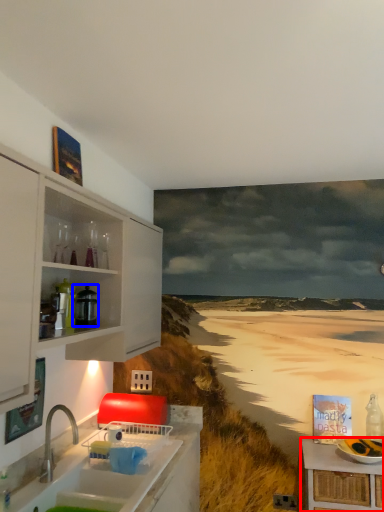
Question: Which object appears farthest to the camera in this image, table (highlighted by a red box) or appliance (highlighted by a blue box)?

Choices:
 (A) table
 (B) appliance

Answer: (B)